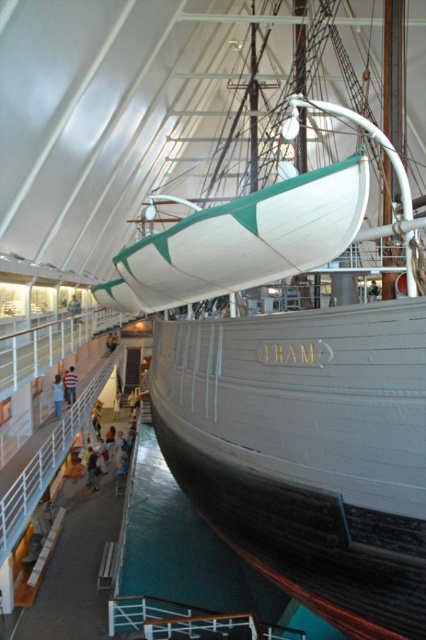
You are a tour guide standing 5 meters away from the ship Fram. You notice a white cotton shirt at center and a light brown wooden person at center in the museum. Can you determine if you can walk directly between them without needing to move either object?

The white cotton shirt at center and the light brown wooden person at center are 4.92 meters apart. Since you are standing 5 meters away from the ship Fram, the distance between the two objects is slightly less than your distance from the ship. However, without knowing the exact positioning of the objects relative to your location, it is uncertain if you can walk directly between them without moving either object.

You are a visitor at the museum and want to take a photo of the historic ship Fram. However, there is a white cotton shirt at center blocking your view. Can you move to the left or right to avoid it?

The white cotton shirt at center is located at point [69,385]. Since the shirt is at the center, moving either to the left or right should allow you to avoid it and get a clear view of the ship Fram.